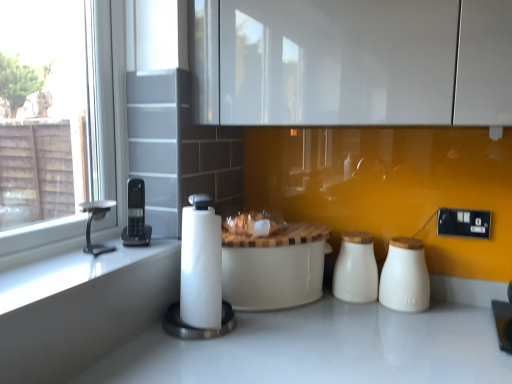
Locate an element on the screen. The image size is (512, 384). free region on the left part of silver metallic faucet at left is located at coordinates (60, 255).